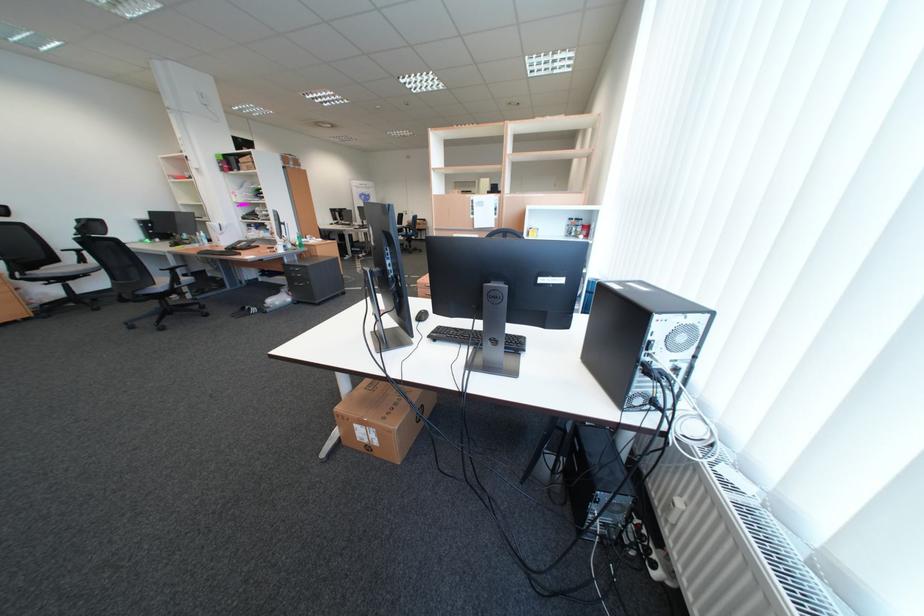
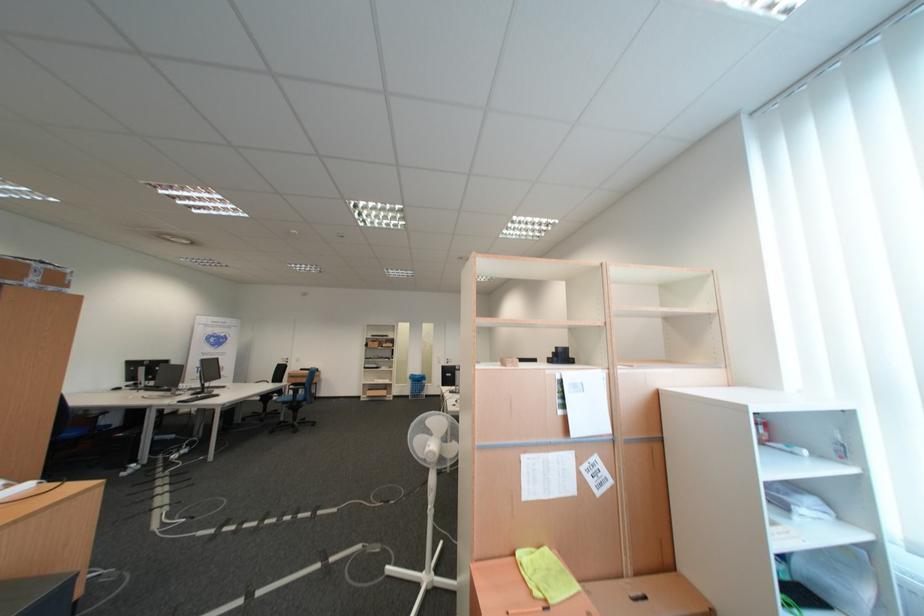
The point at (304,164) is marked in the first image. Where is the corresponding point in the second image?

(45, 280)